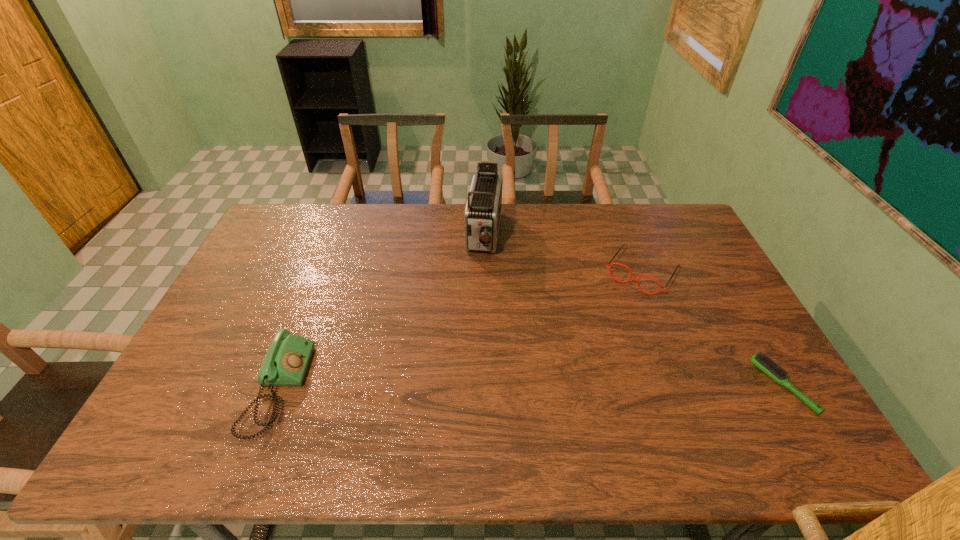
You are a GUI agent. You are given a task and a screenshot of the screen. Output one action in this format:
    pyautogui.click(x=<x>, y=<y>)
    Task: Click on the vacant area between the telephone and the camcorder
    The height and width of the screenshot is (540, 960).
    Given the screenshot: What is the action you would take?
    pyautogui.click(x=381, y=313)

Locate an element on the screen. free space between the third tallest object and the camcorder is located at coordinates (563, 254).

At what (x,y) coordinates should I click in order to perform the action: click on vacant space in between the second shortest object and the shortest object. Please return your answer as a coordinate pair (x, y). The image size is (960, 540). Looking at the image, I should click on (712, 329).

Image resolution: width=960 pixels, height=540 pixels. What are the coordinates of `empty space between the leftmost object and the second object from right to left` in the screenshot? It's located at (460, 330).

Locate an element on the screen. The width and height of the screenshot is (960, 540). vacant space that's between the second shortest object and the camcorder is located at coordinates (563, 254).

Find the location of a particular element. The height and width of the screenshot is (540, 960). free space between the tallest object and the second object from right to left is located at coordinates (563, 254).

Image resolution: width=960 pixels, height=540 pixels. Identify the location of free space between the tallest object and the rightmost object. (634, 310).

Locate an element on the screen. The height and width of the screenshot is (540, 960). the second closest object to the shortest object is located at coordinates (482, 213).

Choose which object is the third nearest neighbor to the third object from left to right. Please provide its 2D coordinates. Your answer should be formatted as a tuple, i.e. [(x, y)], where the tuple contains the x and y coordinates of a point satisfying the conditions above.

[(285, 364)]